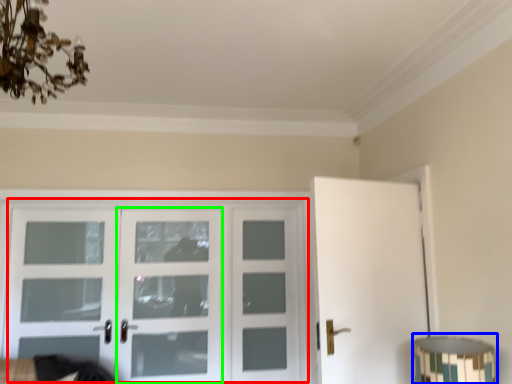
Question: Which object is the farthest from door (highlighted by a red box)? Choose among these: table lamp (highlighted by a blue box) or screen door (highlighted by a green box).

Choices:
 (A) table lamp
 (B) screen door

Answer: (A)